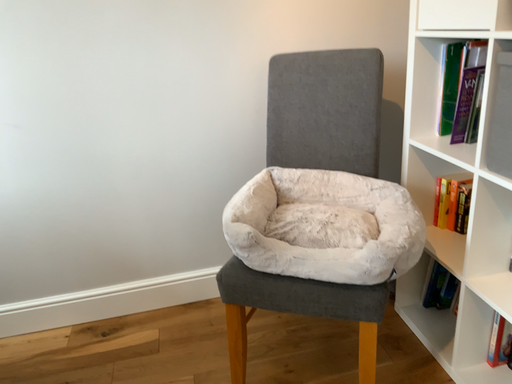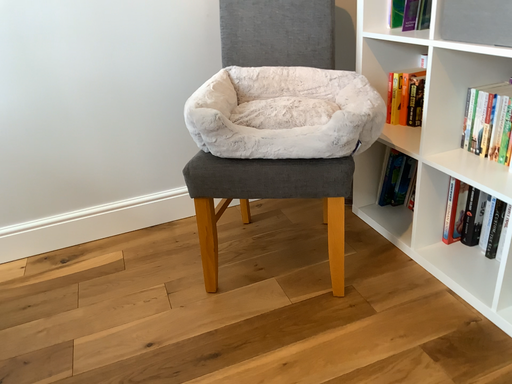
Question: How did the camera likely rotate when shooting the video?

Choices:
 (A) rotated left
 (B) rotated right

Answer: (B)